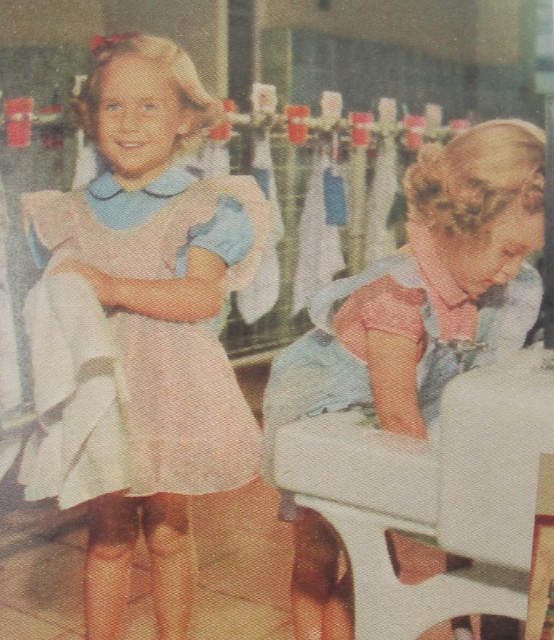
Question: Which point is closer to the camera taking this photo?

Choices:
 (A) (201, 342)
 (B) (404, 481)

Answer: (B)

Question: Which of the following is the farthest from the observer?

Choices:
 (A) pink fabric dress at left
 (B) white fabric chair at lower right

Answer: (A)

Question: Which object appears closest to the camera in this image?

Choices:
 (A) pink fabric dress at left
 (B) white fabric chair at lower right

Answer: (B)

Question: Is pink fabric dress at left to the right of white fabric chair at lower right from the viewer's perspective?

Choices:
 (A) no
 (B) yes

Answer: (A)

Question: Is pink fabric dress at left to the left of white fabric chair at lower right from the viewer's perspective?

Choices:
 (A) yes
 (B) no

Answer: (A)

Question: Can you confirm if pink fabric dress at left is smaller than white fabric chair at lower right?

Choices:
 (A) no
 (B) yes

Answer: (A)